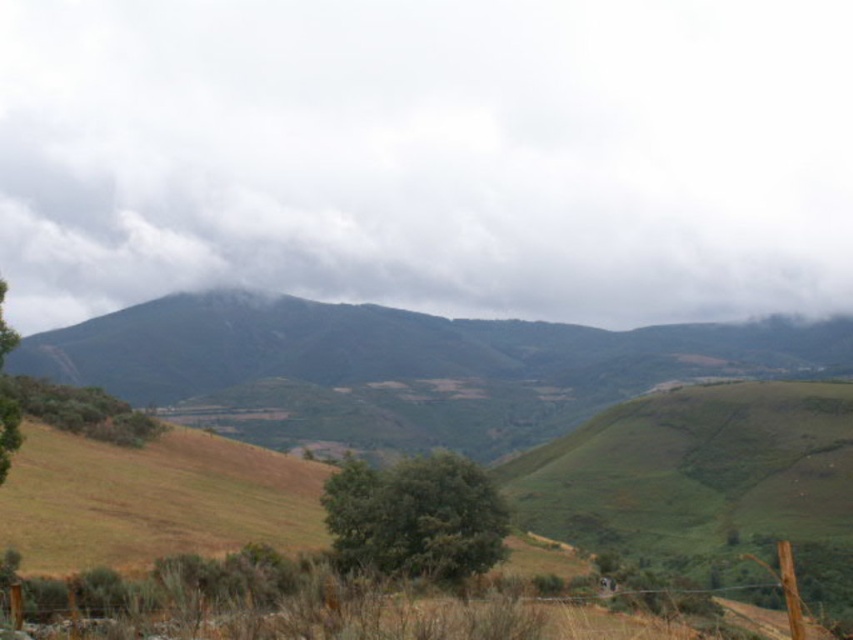
Consider the image. Which is more to the right, white fluffy cloud at upper center or green leafy tree at center?

green leafy tree at center is more to the right.

Can you confirm if white fluffy cloud at upper center is wider than green leafy tree at center?

Yes.

The height and width of the screenshot is (640, 853). Describe the element at coordinates (428, 156) in the screenshot. I see `white fluffy cloud at upper center` at that location.

Where is `white fluffy cloud at upper center`? white fluffy cloud at upper center is located at coordinates (428, 156).

Between point (376, 358) and point (459, 532), which one is positioned behind?

The point (376, 358) is more distant.

Where is `green grassy mountain at center`? Image resolution: width=853 pixels, height=640 pixels. green grassy mountain at center is located at coordinates (399, 369).

Who is more distant from viewer, (795,353) or (415,509)?

The point (795,353) is behind.

Identify the location of green grassy mountain at center. (399, 369).

Can you confirm if brown wooden fence at lower center is positioned above green leafy tree at lower left?

No.

Does point (32, 608) lie behind point (50, 410)?

No.

Measure the distance between point (97, 609) and camera.

The distance of point (97, 609) from camera is 155.82 feet.

You are a GUI agent. You are given a task and a screenshot of the screen. Output one action in this format:
    pyautogui.click(x=<x>, y=<y>)
    Task: Click on the brown wooden fence at lower center
    The width and height of the screenshot is (853, 640).
    Given the screenshot: What is the action you would take?
    pyautogui.click(x=308, y=605)